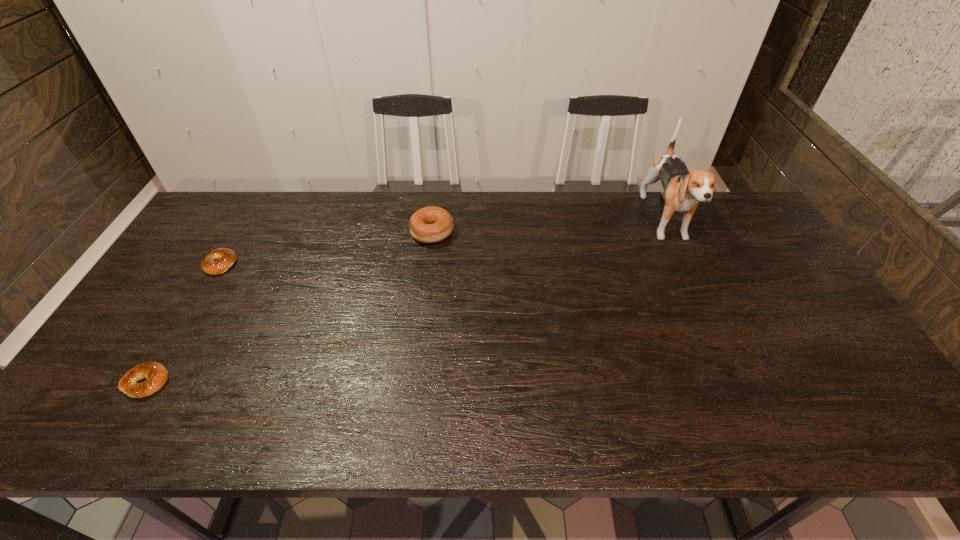
The height and width of the screenshot is (540, 960). Find the location of `puppy`. puppy is located at coordinates (682, 190).

Image resolution: width=960 pixels, height=540 pixels. Identify the location of the tallest object. (682, 190).

Locate an element on the screen. the farthest bagel is located at coordinates (432, 224).

What are the coordinates of `the second tallest object` in the screenshot? It's located at (432, 224).

Find the location of a particular element. the second nearest bagel is located at coordinates (227, 257).

The image size is (960, 540). I want to click on the nearest object, so click(156, 374).

Locate an element on the screen. The image size is (960, 540). free point located 0.350m at the face of the tallest object is located at coordinates (727, 355).

This screenshot has height=540, width=960. I want to click on free space located 0.120m on the back of the farthest bagel, so [437, 198].

Where is `blank area located on the back of the second nearest bagel`? The width and height of the screenshot is (960, 540). blank area located on the back of the second nearest bagel is located at coordinates (262, 193).

Where is `free region located 0.290m on the back of the nearest object`? This screenshot has height=540, width=960. free region located 0.290m on the back of the nearest object is located at coordinates (207, 280).